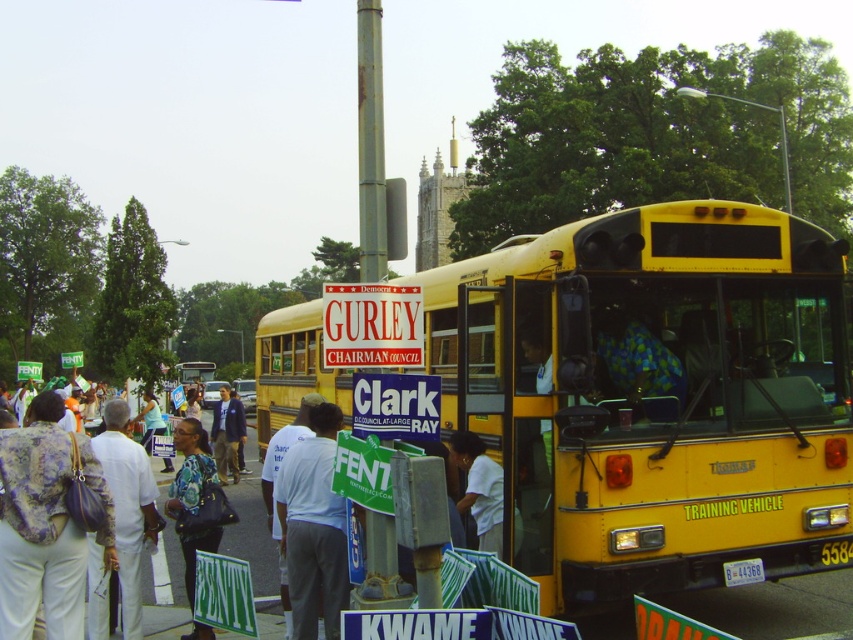
You are standing at the event and want to take a photo of the point at coordinates (294, 445). Your camera has a maximum focus range of 8 meters. Will you be able to focus on the point?

The point at coordinates (294, 445) is 7.84 meters from the viewer. Since the camera can focus up to 8 meters, you can focus on the point.

You are a photographer at the event and want to capture both the white fabric shirt at left and the dark blue fabric jacket at center in a single photo. Which one should you focus on first to ensure both are in frame?

The white fabric shirt at left is positioned on the right side of the dark blue fabric jacket at center, so focusing on the dark blue fabric jacket at center first will help ensure both are in frame since it is centrally located and the white fabric shirt at left is to its right.